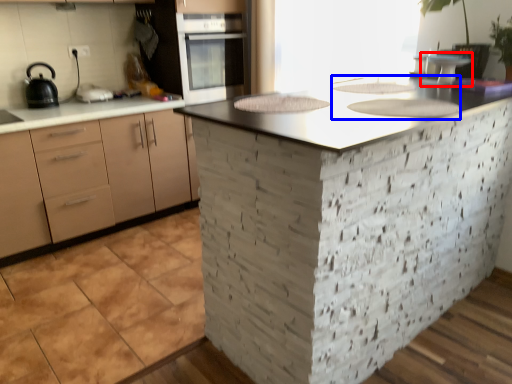
Question: Which point is further to the camera, appliance (highlighted by a red box) or sink (highlighted by a blue box)?

Choices:
 (A) appliance
 (B) sink

Answer: (A)